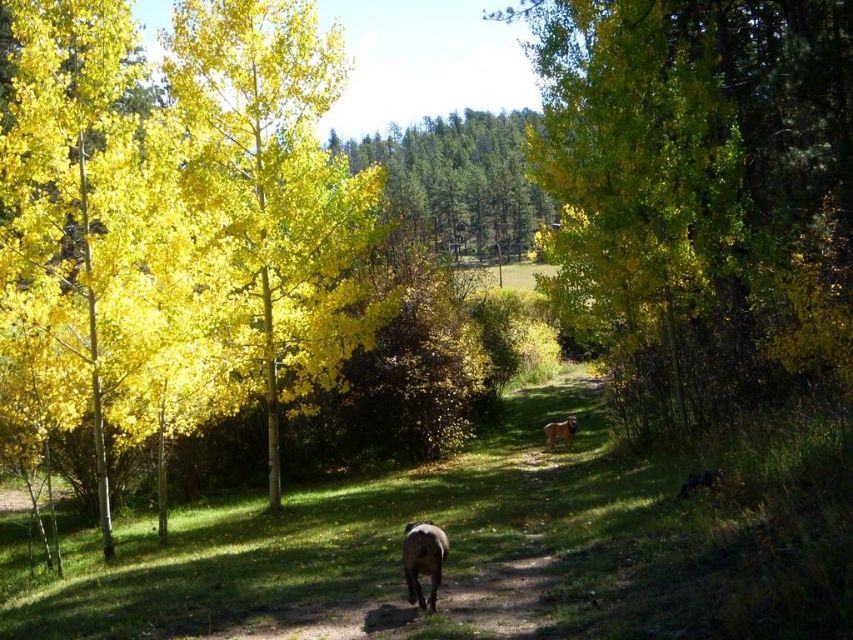
Question: Which point is closer to the camera taking this photo?

Choices:
 (A) (405, 554)
 (B) (570, 417)
 (C) (453, 248)

Answer: (A)

Question: Which point appears closest to the camera in this image?

Choices:
 (A) 413,600
 (B) 556,436

Answer: (A)

Question: Can you confirm if green matte tree at center is positioned above brown furry dog at center?

Choices:
 (A) no
 (B) yes

Answer: (B)

Question: Is yellow leafy tree at center below yellow matte tree at left?

Choices:
 (A) no
 (B) yes

Answer: (A)

Question: Can you confirm if yellow leafy tree at center is positioned to the right of green matte tree at center?

Choices:
 (A) yes
 (B) no

Answer: (A)

Question: Which of these objects is positioned farthest from the yellow leafy tree at center?

Choices:
 (A) brown furry dog at lower center
 (B) green matte tree at center
 (C) brown furry dog at center
 (D) yellow matte tree at left

Answer: (B)